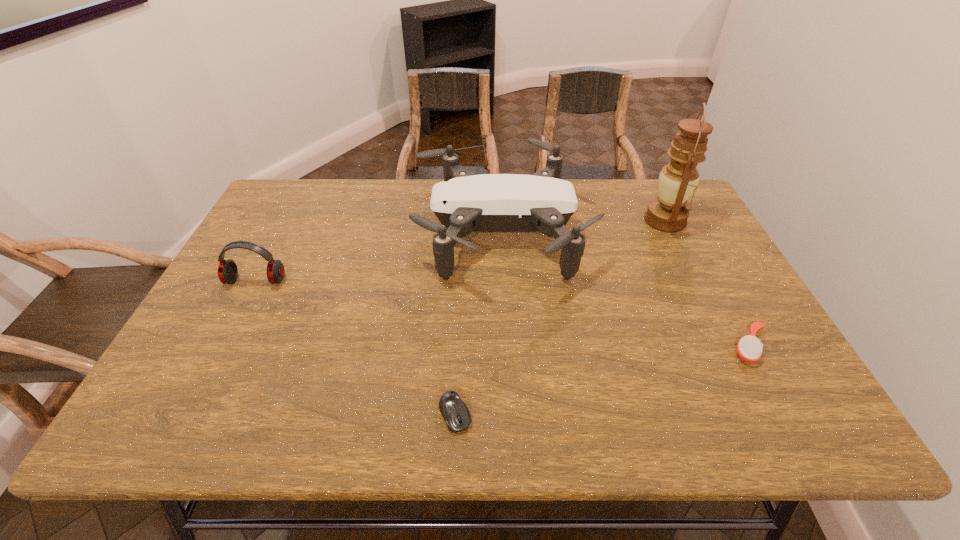
You are a GUI agent. You are given a task and a screenshot of the screen. Output one action in this format:
    pyautogui.click(x=<x>, y=<y>)
    Task: Click on the free spot between the mouse and the tallest object
    Image resolution: width=960 pixels, height=540 pixels.
    Given the screenshot: What is the action you would take?
    pyautogui.click(x=560, y=318)

Where is `blank region between the tallest object and the leftmost object`? blank region between the tallest object and the leftmost object is located at coordinates (461, 251).

The width and height of the screenshot is (960, 540). Find the location of `vacant space that is in between the drone and the hairbrush`. vacant space that is in between the drone and the hairbrush is located at coordinates (625, 289).

Locate an element on the screen. The width and height of the screenshot is (960, 540). unoccupied area between the fourth shortest object and the third shortest object is located at coordinates (x=378, y=257).

Identify the location of object that is the second closest to the hairbrush. Image resolution: width=960 pixels, height=540 pixels. (678, 179).

Locate an element on the screen. object that is the fourth closest one to the oil lamp is located at coordinates (227, 271).